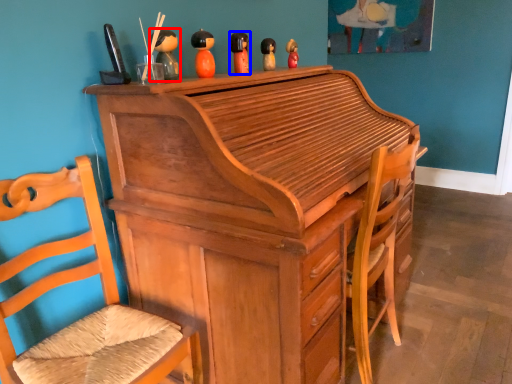
Question: Which point is closer to the camera, toy (highlighted by a red box) or toy (highlighted by a blue box)?

Choices:
 (A) toy
 (B) toy

Answer: (A)